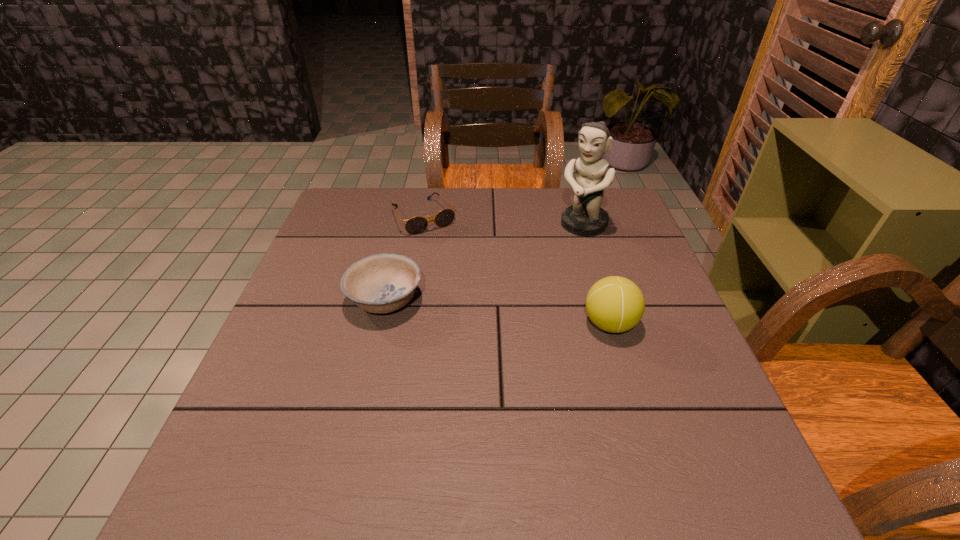
Locate an element on the screen. This screenshot has width=960, height=540. empty space between the tennis ball and the shortest object is located at coordinates (516, 271).

Locate an element on the screen. The height and width of the screenshot is (540, 960). unoccupied area between the tennis ball and the sunglasses is located at coordinates (516, 271).

Identify which object is the nearest to the third shortest object. Please provide its 2D coordinates. Your answer should be formatted as a tuple, i.e. [(x, y)], where the tuple contains the x and y coordinates of a point satisfying the conditions above.

[(585, 217)]

Identify which object is located as the nearest to the tennis ball. Please provide its 2D coordinates. Your answer should be formatted as a tuple, i.e. [(x, y)], where the tuple contains the x and y coordinates of a point satisfying the conditions above.

[(585, 217)]